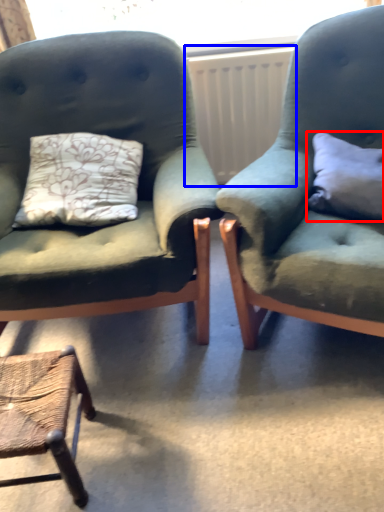
Question: Which object appears farthest to the camera in this image, pillow (highlighted by a red box) or radiator (highlighted by a blue box)?

Choices:
 (A) pillow
 (B) radiator

Answer: (B)